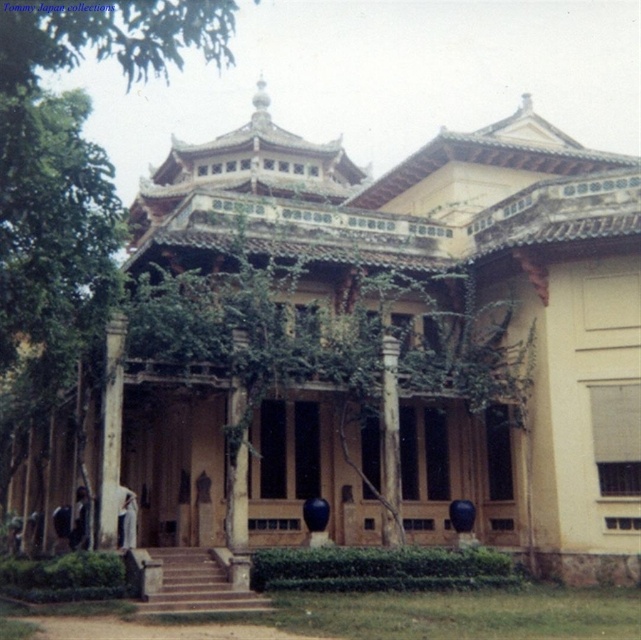
Question: Which of the following is the closest to the observer?

Choices:
 (A) green leafy tree at lower left
 (B) smooth stone column at center

Answer: (A)

Question: Can you confirm if green leafy tree at lower left is smaller than smooth stone column at center?

Choices:
 (A) no
 (B) yes

Answer: (A)

Question: Is green leafy tree at lower left further to the viewer compared to smooth stone column at center?

Choices:
 (A) yes
 (B) no

Answer: (B)

Question: Among these points, which one is nearest to the camera?

Choices:
 (A) (110, 330)
 (B) (53, 244)

Answer: (B)

Question: Which point is closer to the camera?

Choices:
 (A) 104,528
 (B) 162,49

Answer: (B)

Question: Does green leafy tree at lower left have a smaller size compared to smooth stone column at center?

Choices:
 (A) yes
 (B) no

Answer: (B)